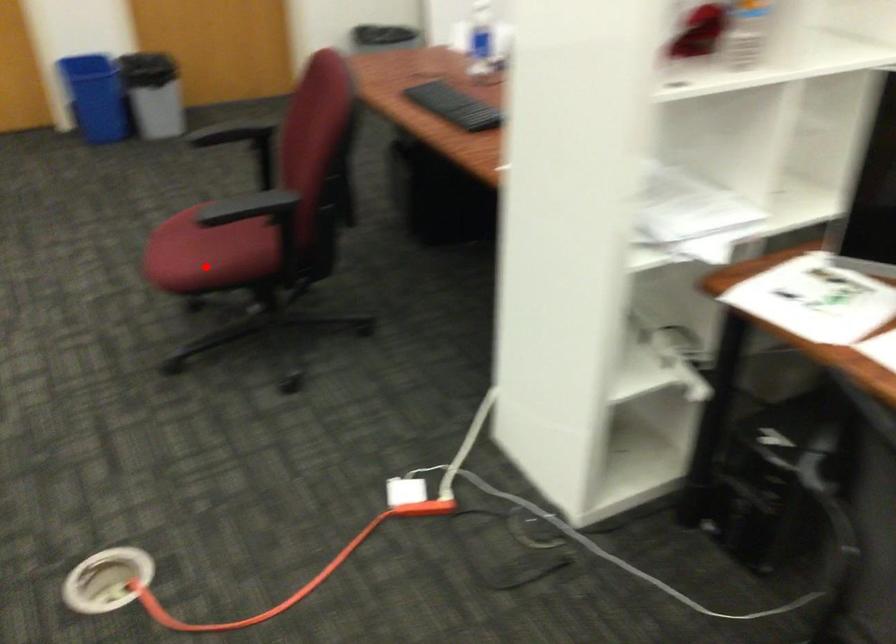
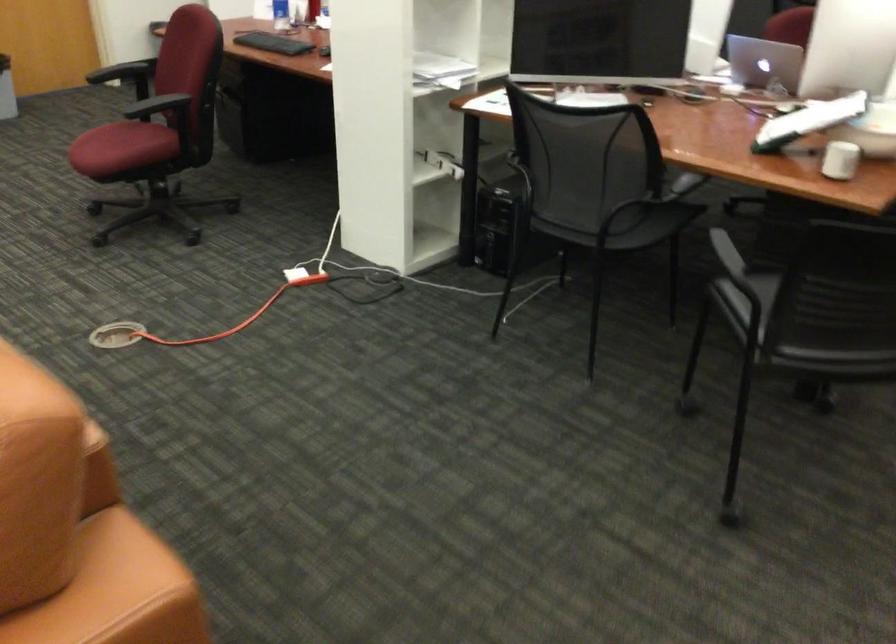
Locate, in the second image, the point that corresponds to the highlighted location in the first image.

(122, 147)